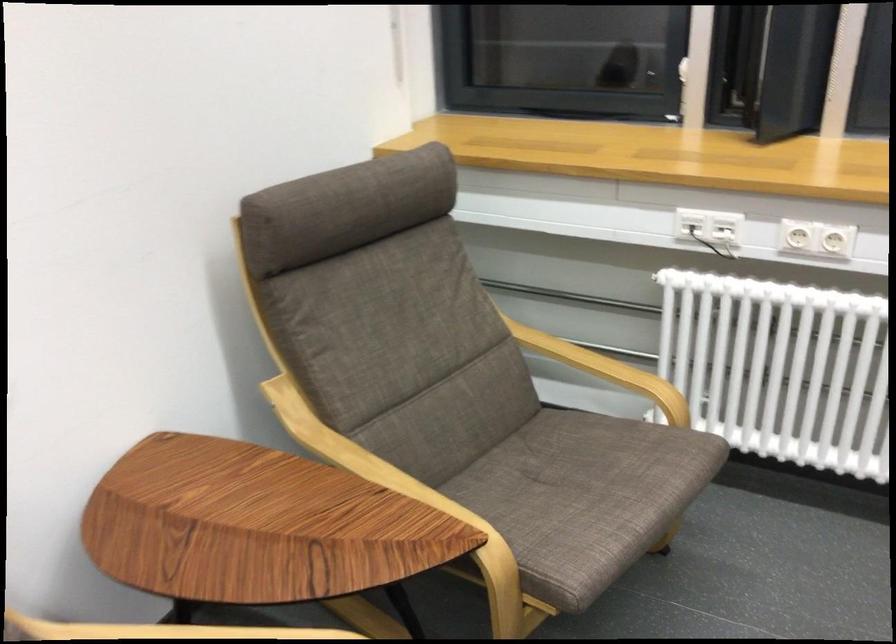
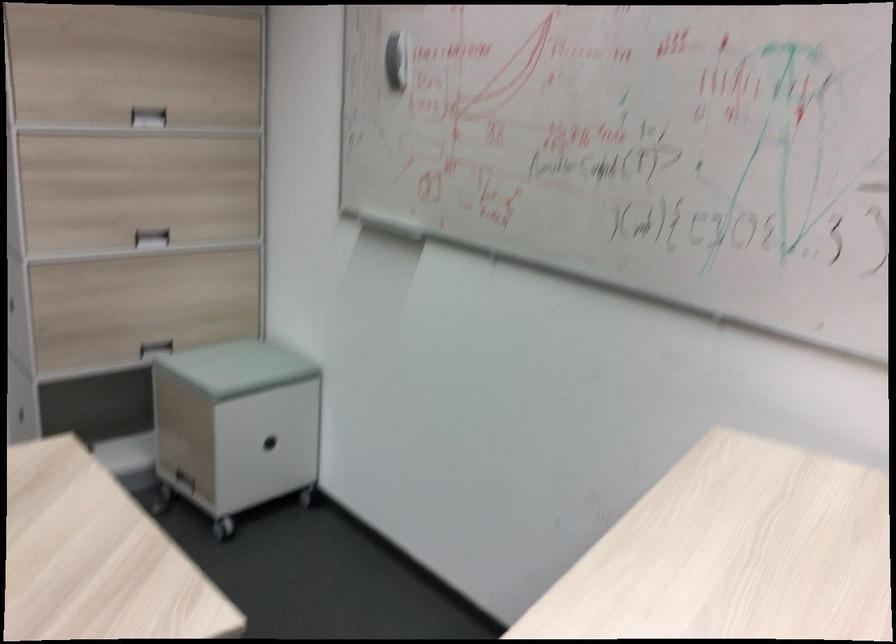
Based on the continuous images, in which direction is the camera rotating?

The camera's rotation is toward left-down.